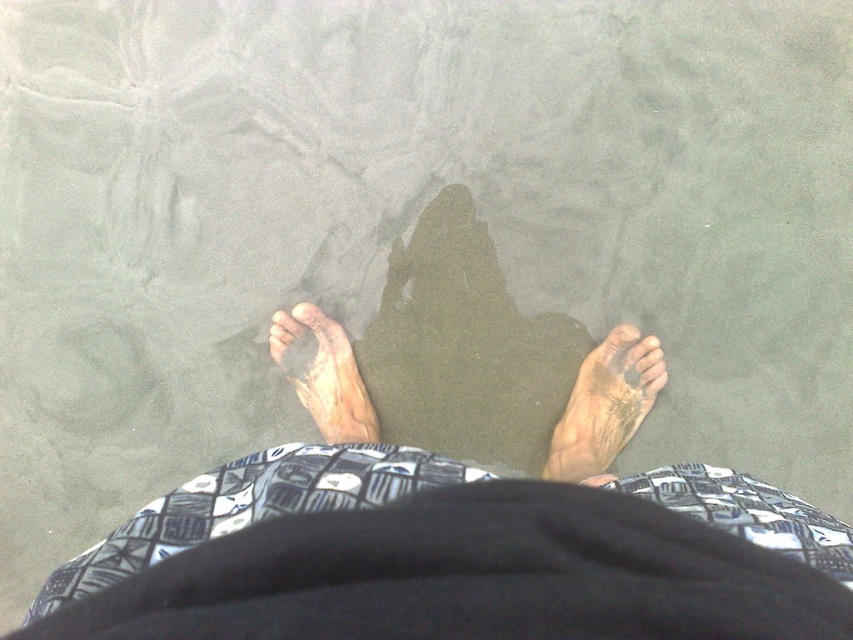
Between brown sand at center and dry skin foot at center, which one has less height?

dry skin foot at center

Identify the location of brown sand at center. (451, 262).

Is brown sand at center bigger than brown matte toe at lower right?

Yes.

Can you confirm if brown sand at center is positioned below brown matte toe at lower right?

No.

What do you see at coordinates (451, 262) in the screenshot? I see `brown sand at center` at bounding box center [451, 262].

Find the location of a particular element. This screenshot has height=640, width=853. brown sand at center is located at coordinates (451, 262).

Can you confirm if brown sand at center is wider than pale skin toe at center?

Yes, brown sand at center is wider than pale skin toe at center.

Measure the distance between brown sand at center and camera.

brown sand at center and camera are 1.27 meters apart from each other.

The width and height of the screenshot is (853, 640). Find the location of `brown sand at center`. brown sand at center is located at coordinates (451, 262).